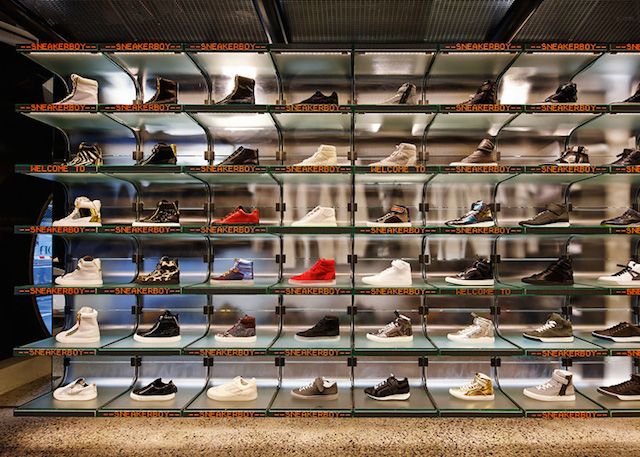
Where is `bottom shelve`? bottom shelve is located at coordinates (68, 410), (145, 412), (211, 413), (296, 409), (369, 413), (456, 412), (541, 412), (618, 413).